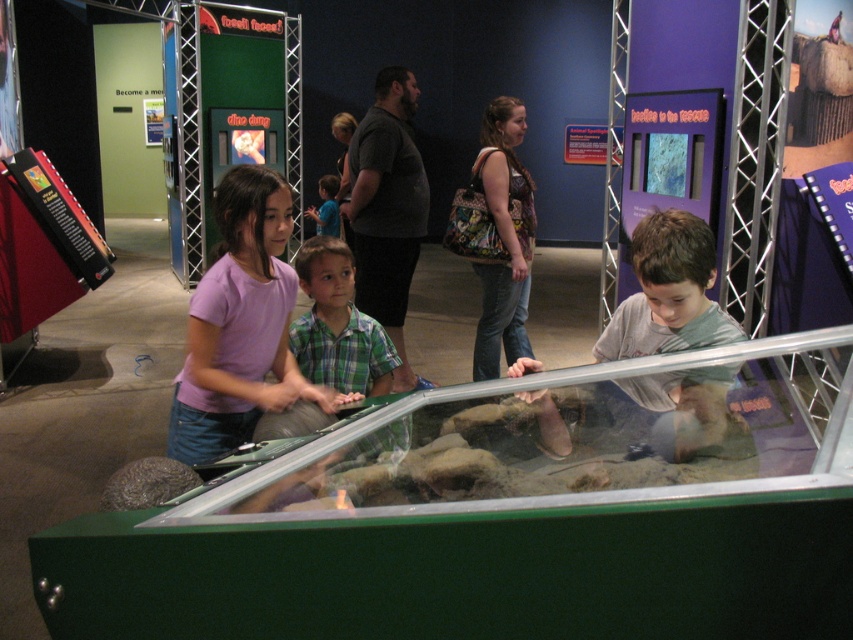
You are a visitor at the museum and want to take a photo of the green matte glass box at center without any people blocking it. Based on the coordinates provided in the Objects Description, where should you position yourself relative to the exhibit to ensure a clear view?

The green matte glass box at center is located at point coordinates, so positioning yourself directly in front of it along the central axis would provide an unobstructed view, avoiding the group of people gathered around the exhibit on the left.

You are a photographer standing in front of the glass enclosure. You want to take a photo of both the pink cotton shirt at center and the green plaid shirt at center. Which shirt should you position to your left side in the frame to capture both in the shot?

The green plaid shirt at center should be positioned to your left side in the frame because the pink cotton shirt at center is to the right of the green plaid shirt at center, so placing the green plaid shirt at center on the left will allow both to be included in the photo.

You are standing at the entrance of the museum exhibit and see two points marked on the floor. The first point is at coordinate point (793, 608) and the second is at coordinate point (258, 412). Which point is closer to you?

Point (793, 608) is in front of point (258, 412), so it is closer to you.